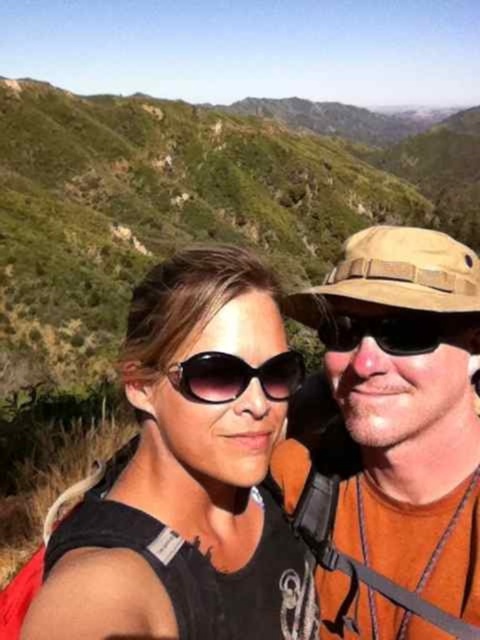
Question: Is the position of black matte sunglasses at center less distant than that of matte black sunglasses at center?

Choices:
 (A) no
 (B) yes

Answer: (A)

Question: Which of the following is the closest to the observer?

Choices:
 (A) (54, 573)
 (B) (282, 396)
 (C) (291, 308)

Answer: (A)

Question: Which of these objects is positioned farthest from the brown canvas hat at upper right?

Choices:
 (A) matte black sunglasses at center
 (B) matte black tank top at center

Answer: (A)

Question: Which point is closer to the camera taking this photo?

Choices:
 (A) [x=197, y=449]
 (B) [x=215, y=365]
 (C) [x=391, y=564]
 (D) [x=422, y=324]

Answer: (B)

Question: Is the position of black matte sunglasses at center less distant than that of matte black sunglasses at center?

Choices:
 (A) yes
 (B) no

Answer: (B)

Question: Is the position of matte black tank top at center less distant than that of black matte sunglasses at center?

Choices:
 (A) no
 (B) yes

Answer: (B)